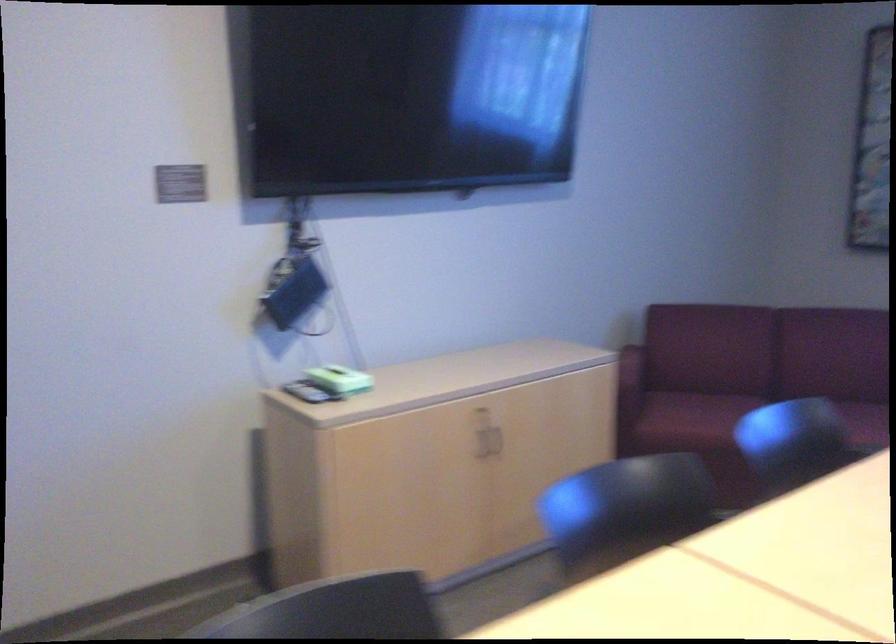
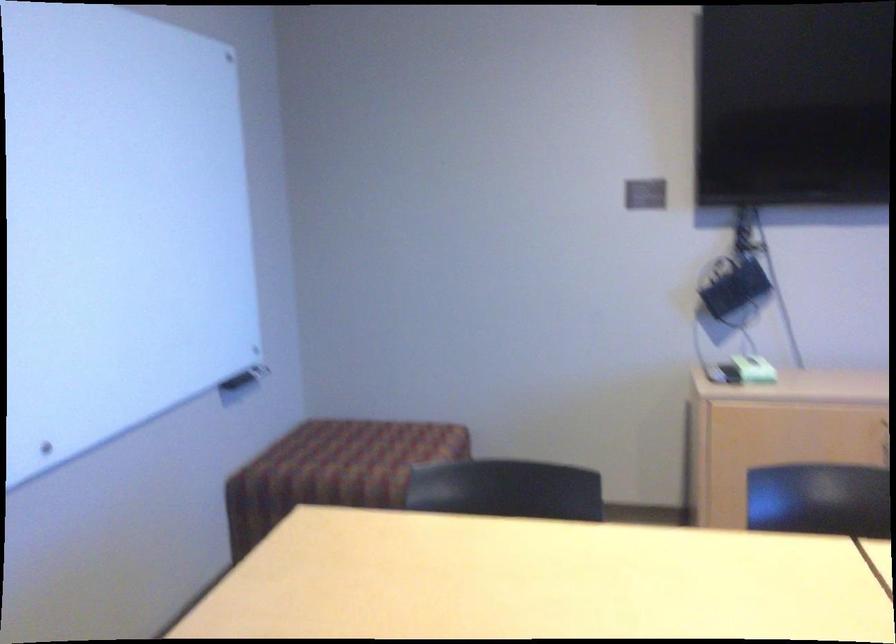
Find the pixel in the second image that matches (351,379) in the first image.

(754, 368)